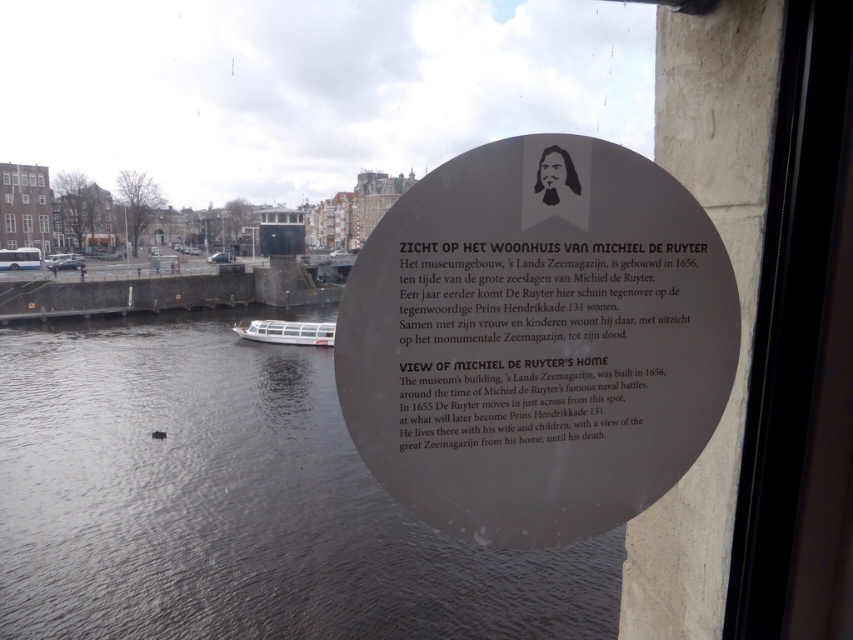
You are standing inside the building looking out the window. You see the dark blue water at lower center and the white plastic boat at lower center. Which object is located below the other?

The dark blue water at lower center is positioned under the white plastic boat at lower center, so the water is below the boat.

You are a tour guide holding a 1.5 inch wide guidebook. You want to place it between the black matte plaque at upper center and the matte black plaque at center. Will it fit without overlapping either plaque?

The distance between the black matte plaque at upper center and the matte black plaque at center is 1.70 inches. Since the guidebook is 1.5 inches wide, it will fit between them without overlapping either plaque.